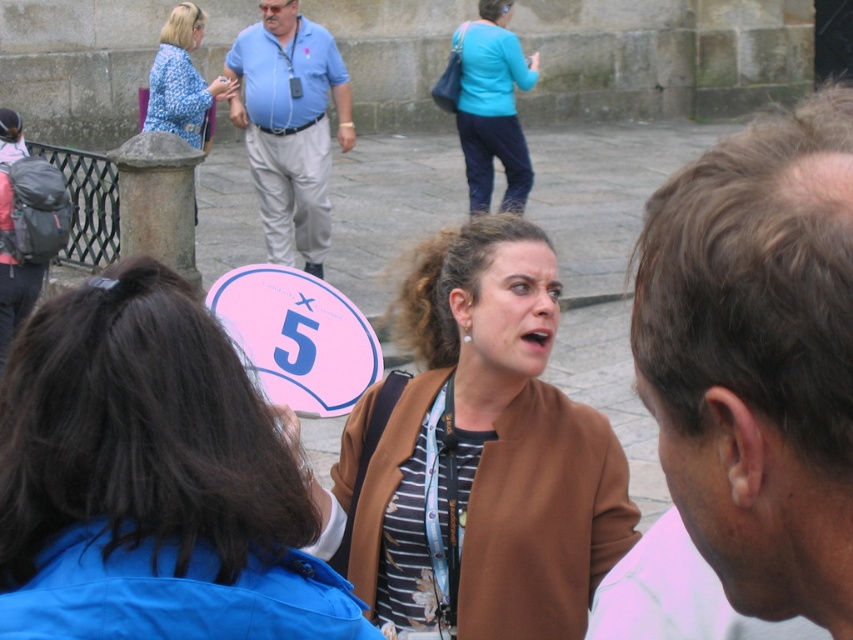
Question: Can you confirm if light brown hair at center is smaller than blue shirt at center?

Choices:
 (A) no
 (B) yes

Answer: (A)

Question: Which object is positioned closest to the matte brown jacket at center?

Choices:
 (A) brown fabric jacket at center
 (B) light brown hair at center
 (C) teal fabric top at upper center

Answer: (B)

Question: Among these points, which one is farthest from the camera?

Choices:
 (A) (416, 588)
 (B) (476, 56)
 (C) (70, 352)
 (D) (791, 336)

Answer: (B)

Question: Can you confirm if matte brown jacket at center is positioned above brown fabric jacket at center?

Choices:
 (A) no
 (B) yes

Answer: (B)

Question: Does light brown hair at center have a lesser width compared to blue shirt at center?

Choices:
 (A) no
 (B) yes

Answer: (A)

Question: Based on their relative distances, which object is farther from the teal fabric top at upper center?

Choices:
 (A) brown fabric jacket at center
 (B) blue shirt at center
 (C) light brown hair at center
 (D) blue printed blouse at upper left

Answer: (A)